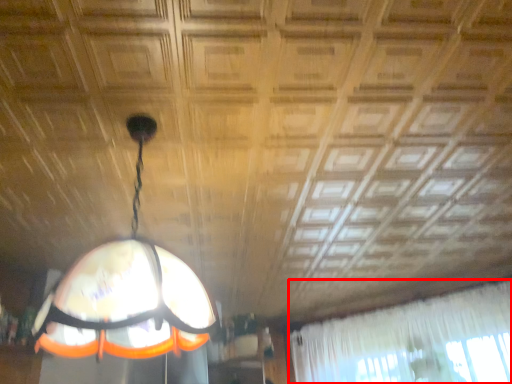
Question: From the image's perspective, where is curtain (annotated by the red box) located in relation to lamp in the image?

Choices:
 (A) below
 (B) above

Answer: (A)